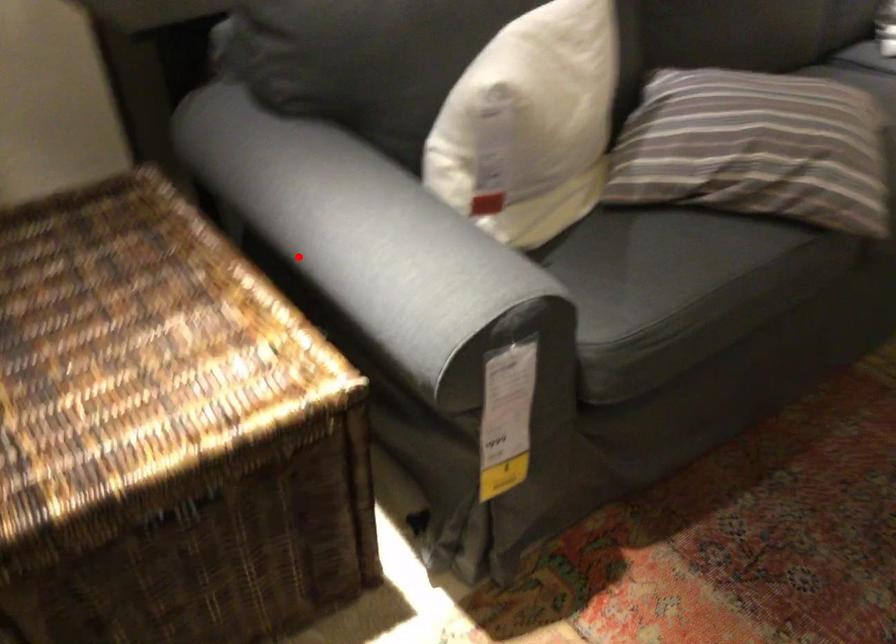
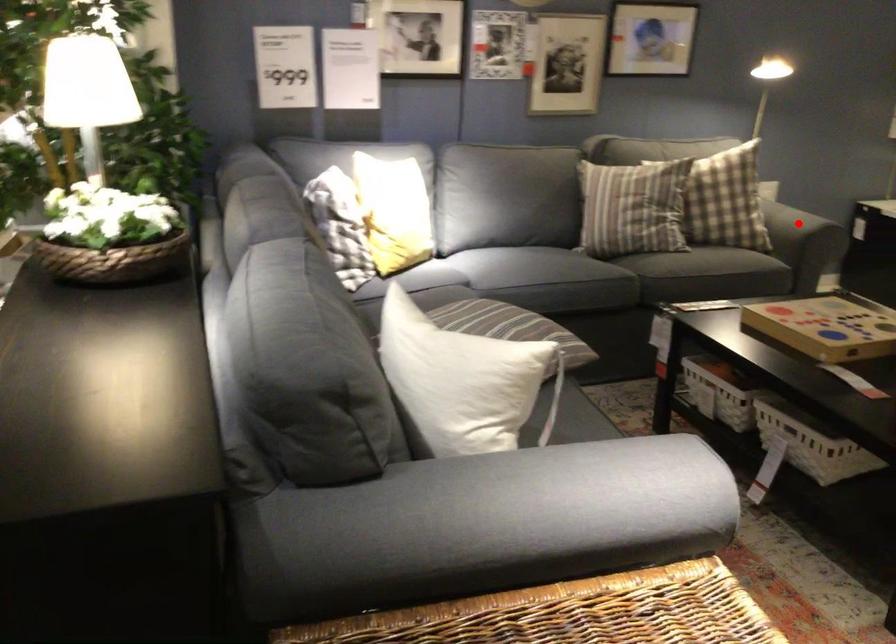
I am providing you with two images of the same scene from different viewpoints. A red point is marked on the first image and another point is marked on the second image. Are the points marked in image1 and image2 representing the same 3D position?

No